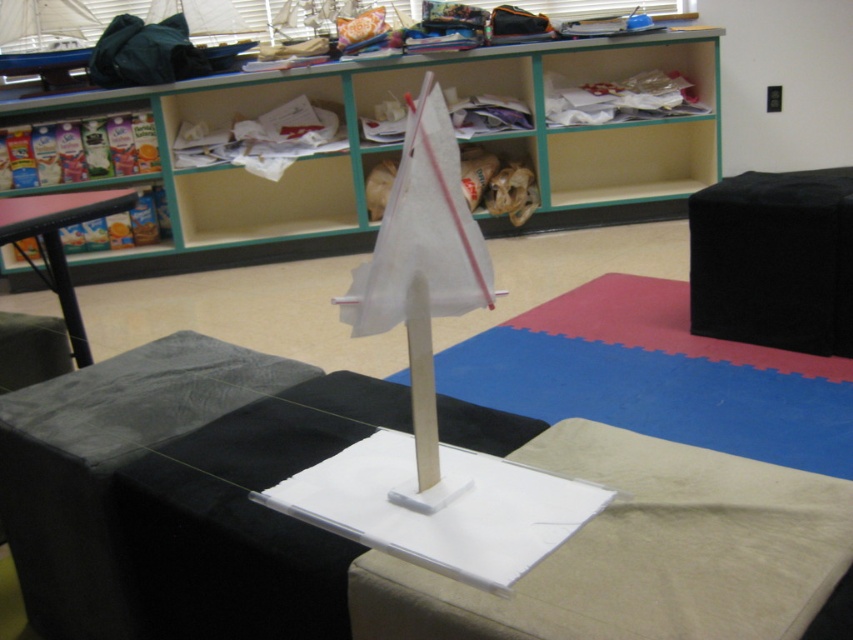
Question: Among these objects, which one is nearest to the camera?

Choices:
 (A) white paper sailboat at center
 (B) black fabric stool at center
 (C) blue rubber mat at center

Answer: (A)

Question: Does blue rubber mat at center appear on the right side of black fabric stool at center?

Choices:
 (A) no
 (B) yes

Answer: (A)

Question: Where is blue rubber mat at center located in relation to black fabric stool at center in the image?

Choices:
 (A) right
 (B) left

Answer: (B)

Question: Which point is closer to the camera taking this photo?

Choices:
 (A) (474, 298)
 (B) (787, 444)
 (C) (837, 353)
 (D) (689, 40)

Answer: (A)

Question: Which of the following is the farthest from the observer?

Choices:
 (A) white paper sailboat at center
 (B) wooden bookshelf at upper center
 (C) black fabric stool at center
 (D) blue rubber mat at center

Answer: (B)

Question: Can you confirm if wooden bookshelf at upper center is smaller than white paper sailboat at center?

Choices:
 (A) no
 (B) yes

Answer: (A)